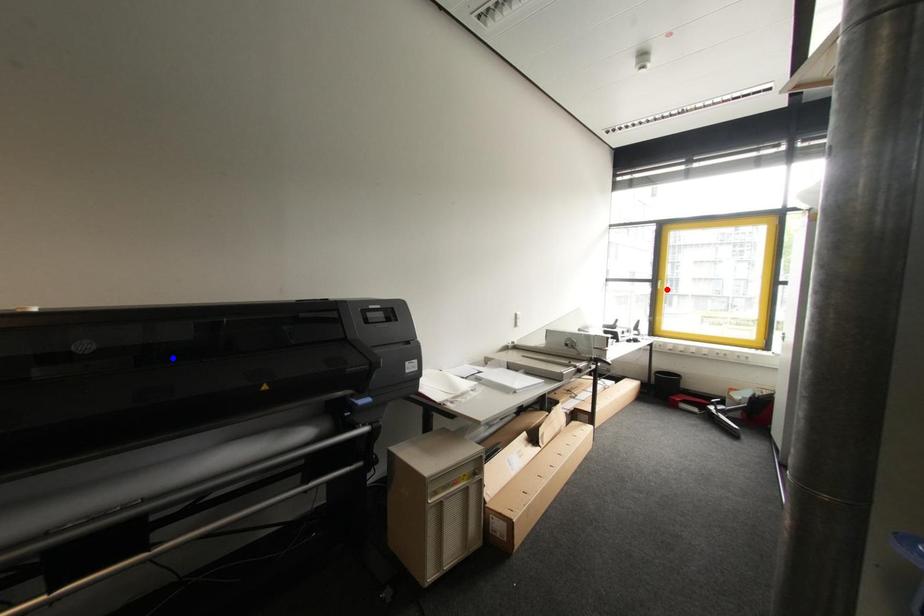
Question: Which of the two points in the image is closer to the camera?

Choices:
 (A) Blue point is closer.
 (B) Red point is closer.

Answer: (A)